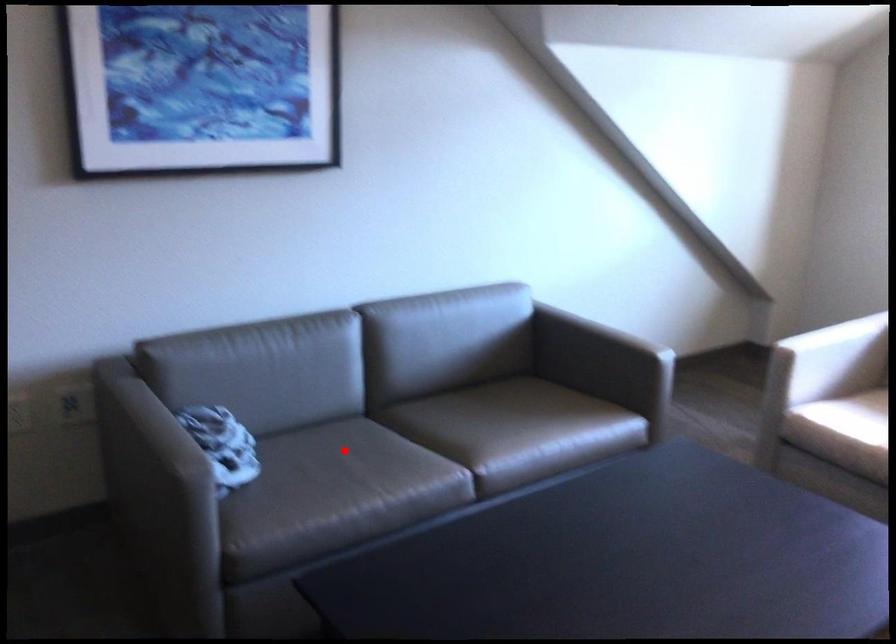
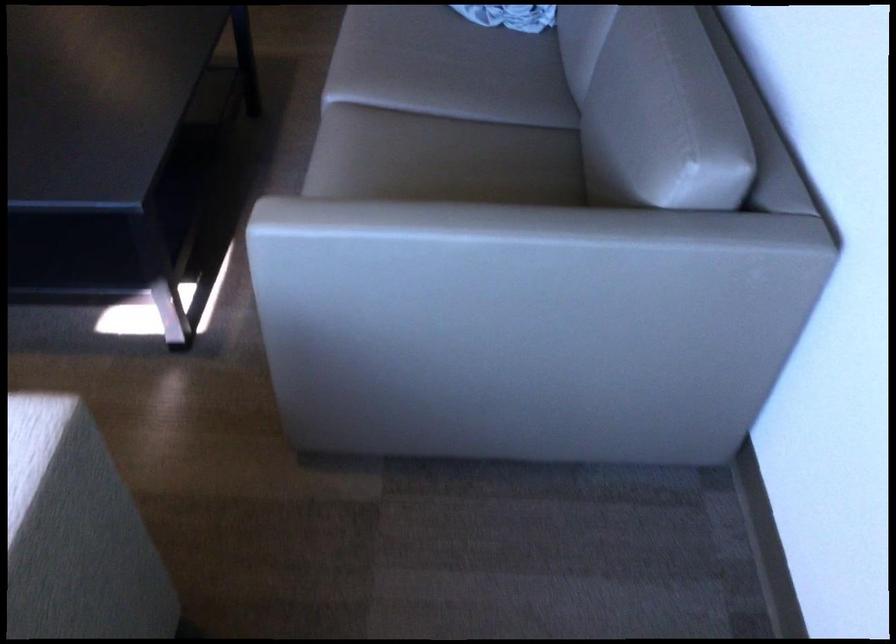
Where in the second image is the point corresponding to the highlighted location from the first image?

(463, 73)